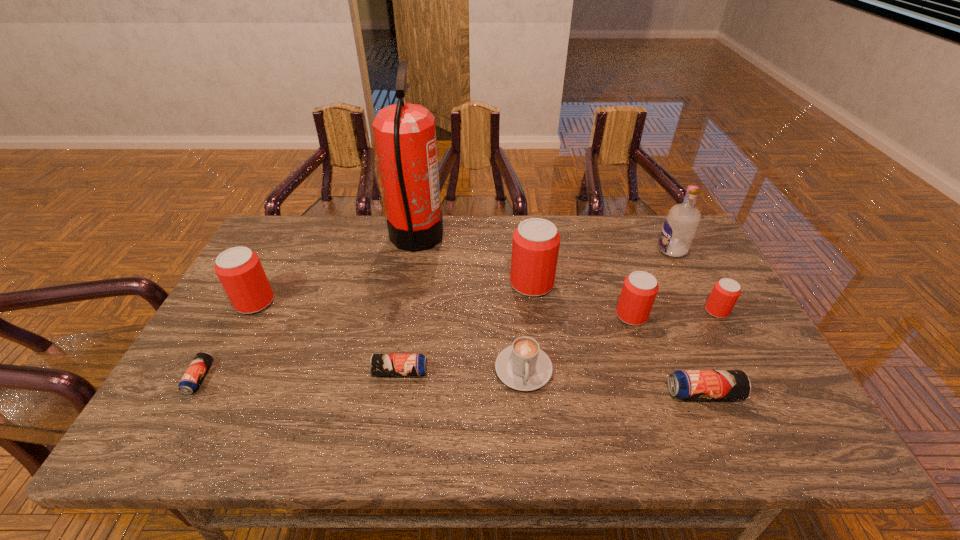
The height and width of the screenshot is (540, 960). Identify the location of vacant space located on the label of the vodka. (549, 250).

In order to click on vacant space located on the label of the vodka in this screenshot , I will do `click(533, 250)`.

Identify the location of vacant space located 0.140m on the front of the third tallest object. The image size is (960, 540). (539, 337).

The height and width of the screenshot is (540, 960). I want to click on vacant space situated on the front of the seventh shortest object, so click(x=217, y=374).

At what (x,y) coordinates should I click in order to perform the action: click on vacant space located on the front of the third biggest red beer can. Please return your answer as a coordinate pair (x, y). This screenshot has height=540, width=960. Looking at the image, I should click on (656, 384).

You are a GUI agent. You are given a task and a screenshot of the screen. Output one action in this format:
    pyautogui.click(x=<x>, y=<y>)
    Task: Click on the blank space located on the left of the rightmost beer can
    The width and height of the screenshot is (960, 540).
    Given the screenshot: What is the action you would take?
    pyautogui.click(x=612, y=311)

Locate an element on the screen. Image resolution: width=960 pixels, height=540 pixels. free region located 0.050m to the right of the seventh tallest object is located at coordinates (527, 413).

Where is `free space located on the right of the biggest blue beer can`? This screenshot has width=960, height=540. free space located on the right of the biggest blue beer can is located at coordinates 782,393.

Find the location of a particular element. The width and height of the screenshot is (960, 540). vacant position located 0.300m on the left of the fifth beer can from right to left is located at coordinates (250, 372).

The image size is (960, 540). What are the coordinates of `vacant space located on the back of the leftmost blue beer can` in the screenshot? It's located at (267, 258).